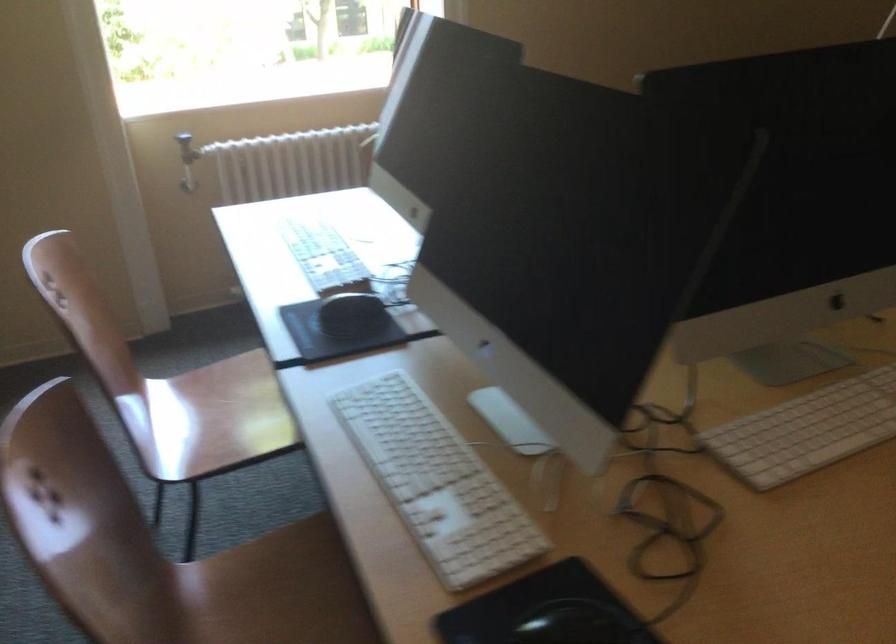
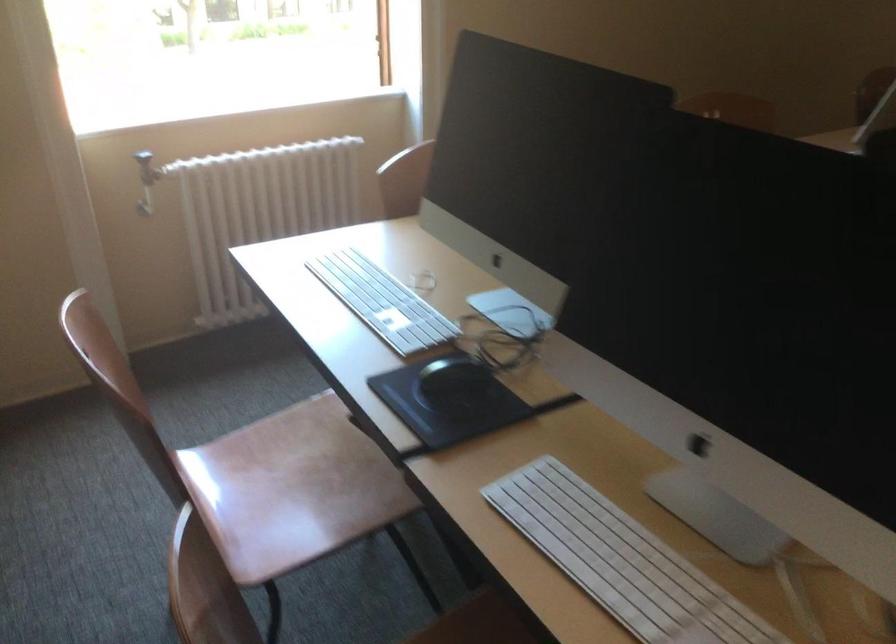
What movement of the cameraman would produce the second image?

The cameraman walked toward left, forward.